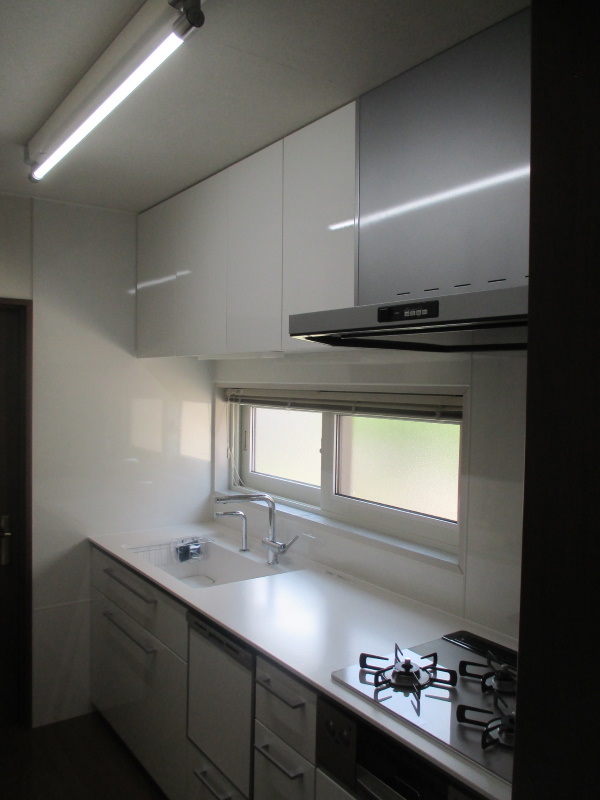
Where is `window blinds`? The width and height of the screenshot is (600, 800). window blinds is located at coordinates (391, 408).